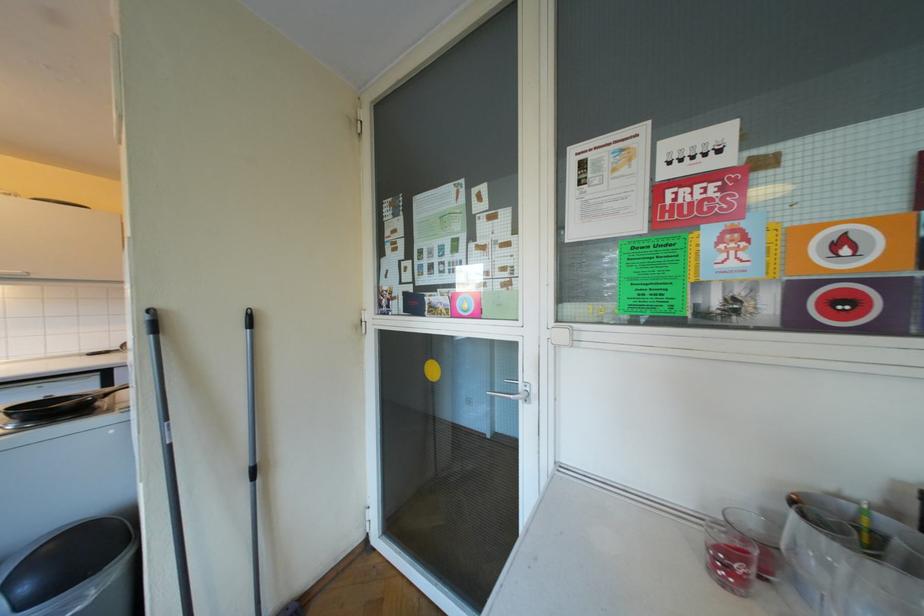
Find where to lift the black trash can lid. Please return your answer as a coordinate pair (x, y).

(64, 561)